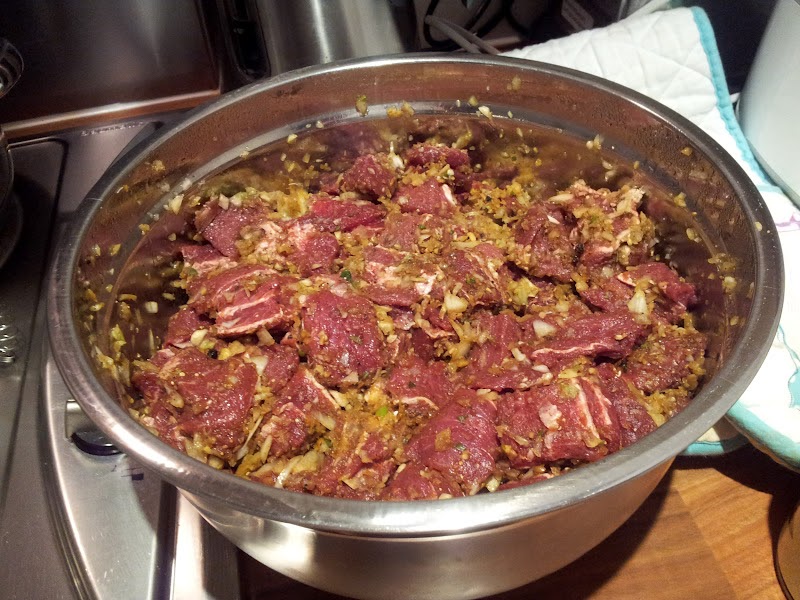
Where is `white oven mit`? This screenshot has width=800, height=600. white oven mit is located at coordinates (772, 400), (670, 56).